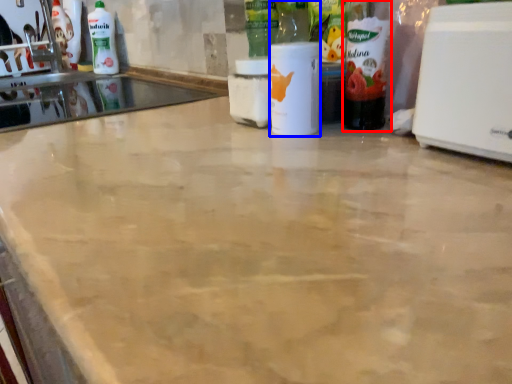
Question: Among these objects, which one is nearest to the camera, bottle (highlighted by a red box) or bottle (highlighted by a blue box)?

Choices:
 (A) bottle
 (B) bottle

Answer: (A)